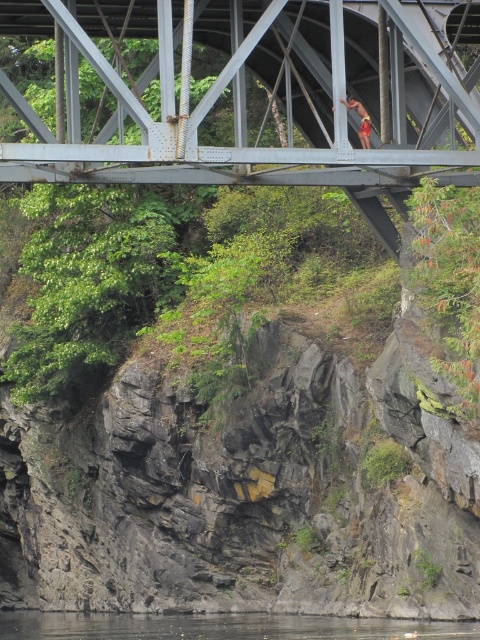
You are a hiker who wants to cross the bridge safely. The metallic gray bridge at center and camouflage shorts at center are in your view. Which object is taller and why?

The metallic gray bridge at center is much taller than the camouflage shorts at center because the description states that it is much taller.

You are a hiker who just finished climbing the metallic gray bridge at center and the camouflage shorts at center. Which object is closer to you now?

The metallic gray bridge at center is closer to you because it is in front of the camouflage shorts at center.

You are a hiker who has just reached the top of the bridge support column and notice the clear water at lower center. Considering the distance between you and the camouflage shorts at center, which is 75.90 feet, would you need to climb down the column to reach the water?

The clear water at lower center is 75.90 feet away from the camouflage shorts at center. Since the camouflage shorts are at your current position, you would need to climb down the column and walk approximately 75.90 feet to reach the water.